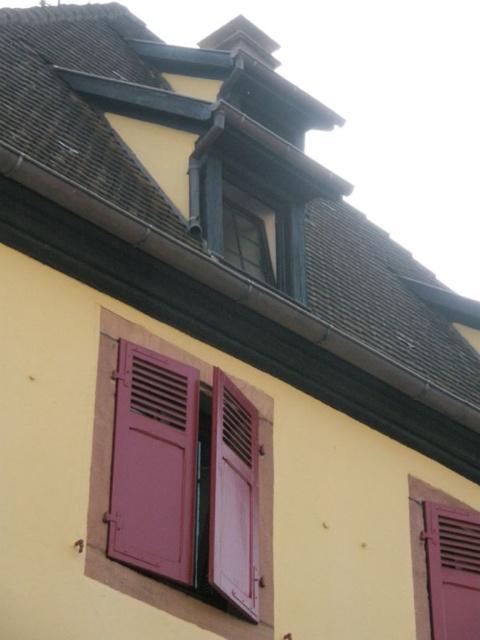
Question: Is matte glass window at upper center above pink matte shutter at lower right?

Choices:
 (A) yes
 (B) no

Answer: (A)

Question: Does matte pink shutters at lower left have a smaller size compared to matte glass window at upper center?

Choices:
 (A) no
 (B) yes

Answer: (B)

Question: Which object is closer to the camera taking this photo?

Choices:
 (A) pink matte shutter at lower right
 (B) matte pink shutters at lower left

Answer: (B)

Question: Is matte pink shutters at lower left above pink matte shutter at lower right?

Choices:
 (A) no
 (B) yes

Answer: (B)

Question: Which object appears farthest from the camera in this image?

Choices:
 (A) pink matte shutter at lower right
 (B) matte pink shutters at lower left

Answer: (A)

Question: Among these objects, which one is nearest to the camera?

Choices:
 (A) pink matte shutter at lower right
 (B) matte glass window at upper center

Answer: (A)